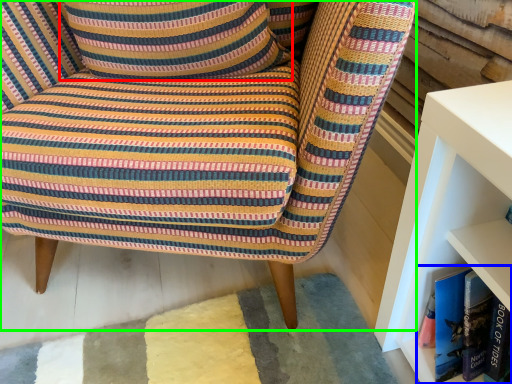
Question: Estimate the real-world distances between objects in this image. Which object is closer to pillow (highlighted by a red box), book (highlighted by a blue box) or chair (highlighted by a green box)?

Choices:
 (A) book
 (B) chair

Answer: (B)